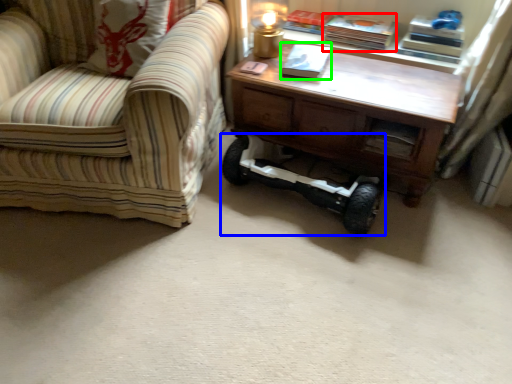
Question: Estimate the real-world distances between objects in this image. Which object is farther from book (highlighted by a red box), segway (highlighted by a blue box) or book (highlighted by a green box)?

Choices:
 (A) segway
 (B) book

Answer: (A)